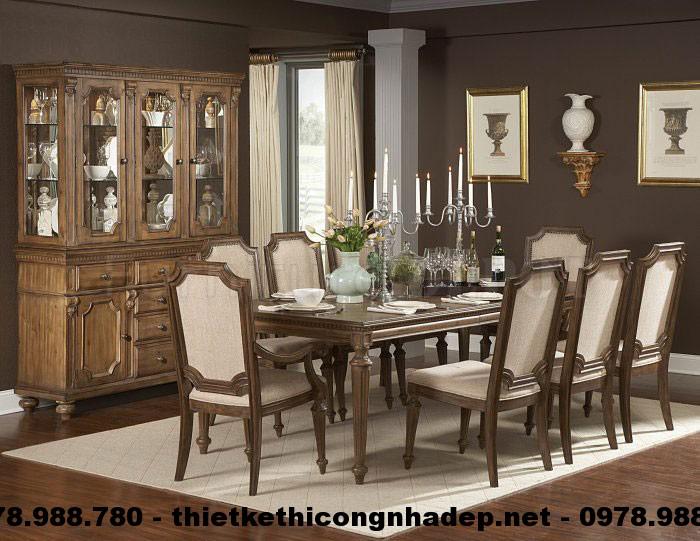
Find the location of a particular element. The image size is (700, 541). candles is located at coordinates (489, 199), (468, 200), (458, 186), (447, 192), (424, 196), (392, 195), (384, 180), (374, 195), (349, 194).